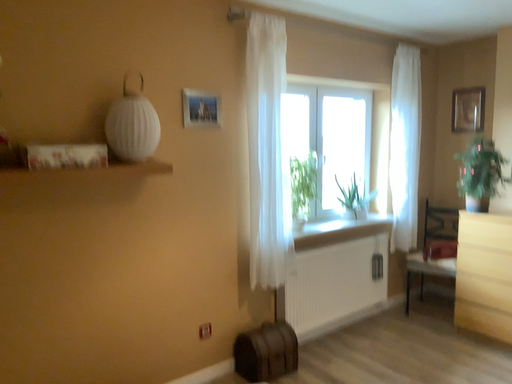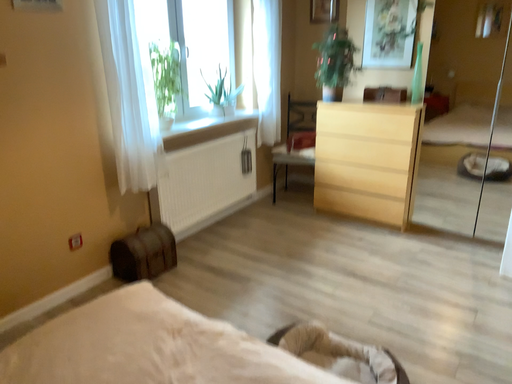
Question: How did the camera likely rotate when shooting the video?

Choices:
 (A) rotated left
 (B) rotated right

Answer: (B)